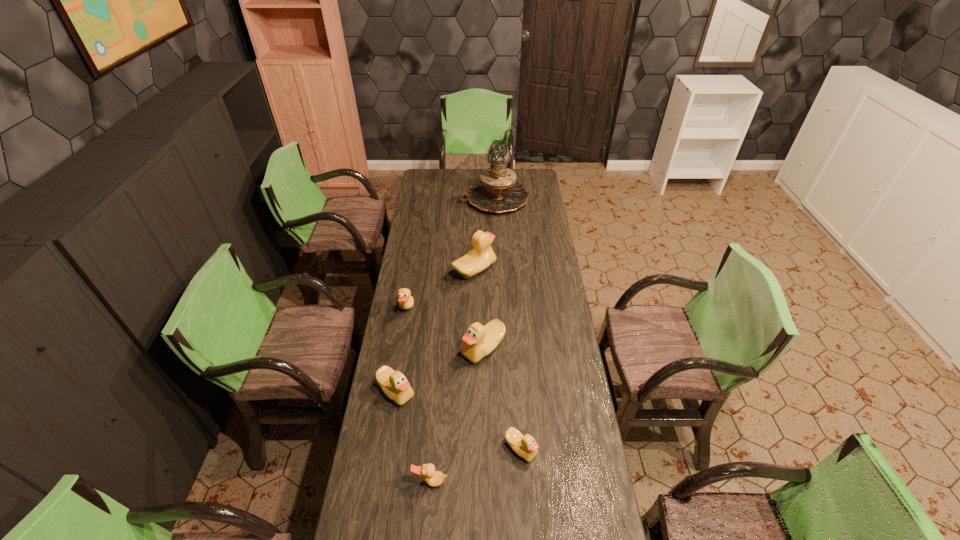
You are a GUI agent. You are given a task and a screenshot of the screen. Output one action in this format:
    pyautogui.click(x=<x>, y=<y>)
    Task: Click on the free space at the far right corner of the desktop
    
    Given the screenshot: What is the action you would take?
    pyautogui.click(x=531, y=189)

Where is `empty space between the third nearest object and the third smallest beige duck`? The image size is (960, 540). empty space between the third nearest object and the third smallest beige duck is located at coordinates (440, 370).

You are a GUI agent. You are given a task and a screenshot of the screen. Output one action in this format:
    pyautogui.click(x=<x>, y=<y>)
    Task: Click on the unoccupied position between the farthest object and the second nearest beige duck
    Image resolution: width=960 pixels, height=540 pixels.
    Given the screenshot: What is the action you would take?
    pyautogui.click(x=445, y=295)

Where is `vacant space that's between the second farthest duck and the nearest duck`? This screenshot has height=540, width=960. vacant space that's between the second farthest duck and the nearest duck is located at coordinates (419, 396).

Where is `free space between the sixth shortest object and the second nearest beige duck`? The width and height of the screenshot is (960, 540). free space between the sixth shortest object and the second nearest beige duck is located at coordinates pyautogui.click(x=435, y=331).

What are the coordinates of `free space between the third farthest beige duck and the biggest beige duck` in the screenshot? It's located at (435, 331).

Locate an element on the screen. This screenshot has width=960, height=540. free space between the farthest beige duck and the nearest beige duck is located at coordinates (497, 360).

The width and height of the screenshot is (960, 540). I want to click on the second closest object relative to the sixth nearest object, so click(x=479, y=341).

Select which object appears as the sixth closest to the right tan duck. Please provide its 2D coordinates. Your answer should be formatted as a tuple, i.e. [(x, y)], where the tuple contains the x and y coordinates of a point satisfying the conditions above.

[(497, 192)]

Identify which duck is the third closest to the nearest duck. Please provide its 2D coordinates. Your answer should be formatted as a tuple, i.e. [(x, y)], where the tuple contains the x and y coordinates of a point satisfying the conditions above.

[(479, 341)]